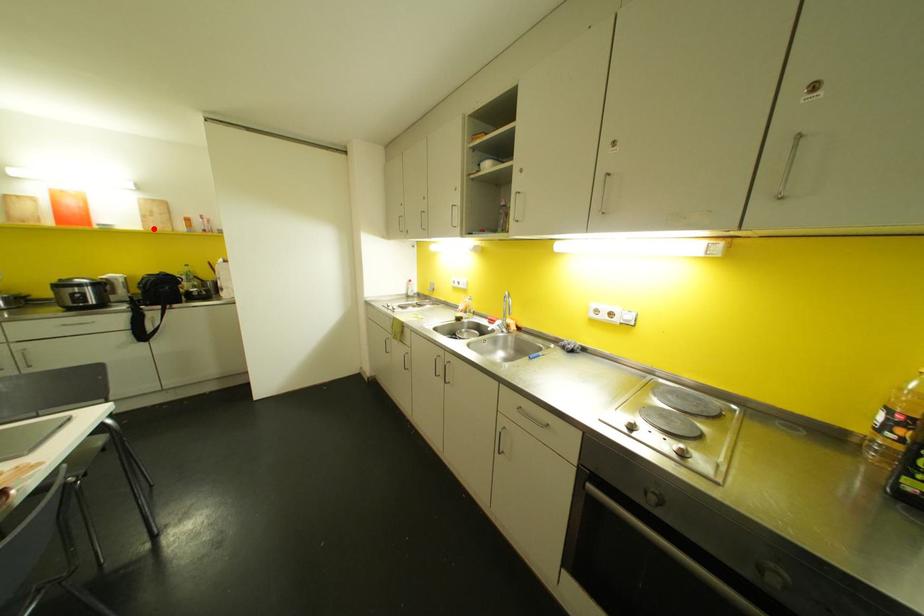
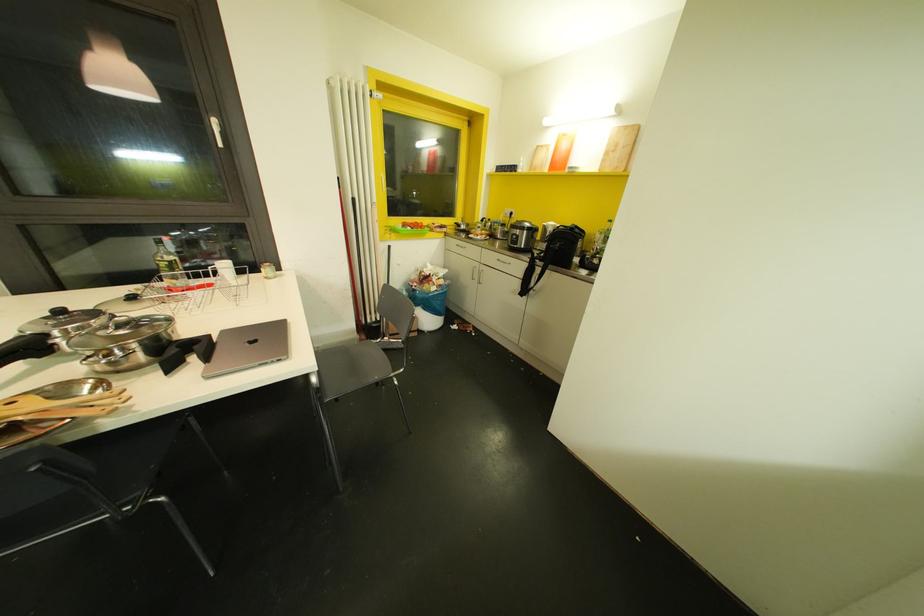
Find the pixel in the second image that matches the highlighted location in the first image.

(606, 169)